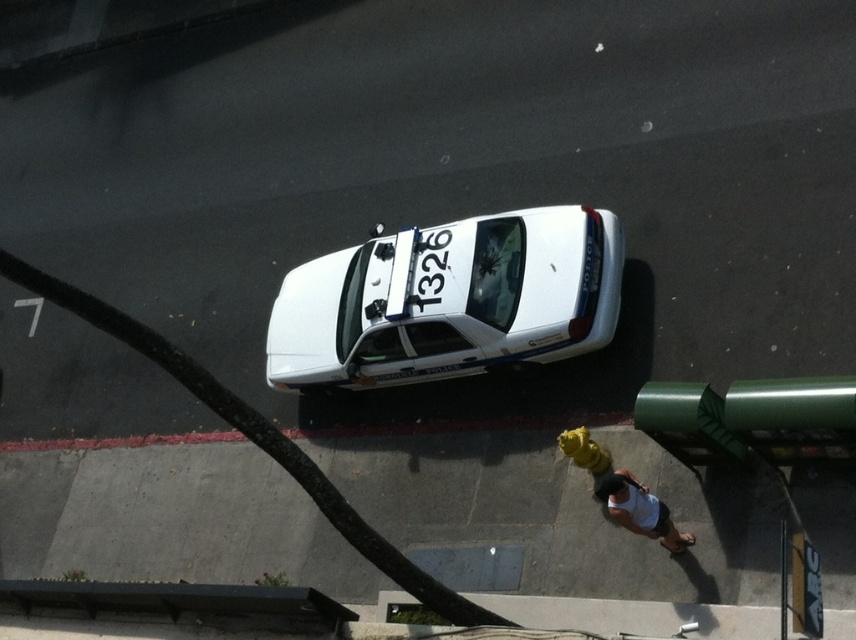
Measure the distance between white glossy police car at center and white tank top at center.

The distance of white glossy police car at center from white tank top at center is 2.64 meters.

Based on the photo, who is higher up, white glossy police car at center or white tank top at center?

white glossy police car at center

Describe the element at coordinates (449, 300) in the screenshot. The height and width of the screenshot is (640, 856). I see `white glossy police car at center` at that location.

What are the coordinates of `white glossy police car at center` in the screenshot? It's located at (449, 300).

Does shiny black car at center have a lesser height compared to white tank top at center?

No.

Is shiny black car at center above white tank top at center?

Indeed, shiny black car at center is positioned over white tank top at center.

Locate an element on the screen. shiny black car at center is located at coordinates (496, 272).

Is white glossy police car at center to the left of shiny black car at center from the viewer's perspective?

Yes, white glossy police car at center is to the left of shiny black car at center.

Does point (367, 364) come farther from viewer compared to point (488, 304)?

Yes, it is behind point (488, 304).

Identify the location of white glossy police car at center. (449, 300).